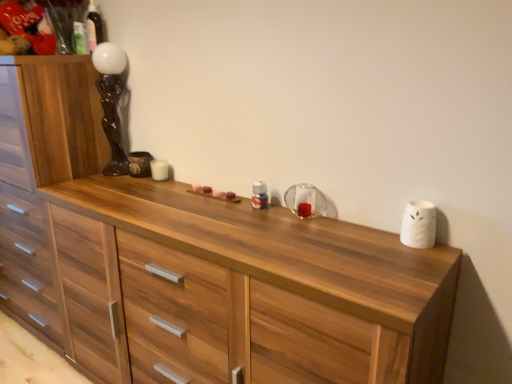
Question: Considering the relative sizes of wooden chest of drawers at left and black glossy statue at upper left in the image provided, is wooden chest of drawers at left shorter than black glossy statue at upper left?

Choices:
 (A) yes
 (B) no

Answer: (B)

Question: Considering the relative sizes of wooden chest of drawers at left and black glossy statue at upper left in the image provided, is wooden chest of drawers at left thinner than black glossy statue at upper left?

Choices:
 (A) no
 (B) yes

Answer: (A)

Question: Does wooden chest of drawers at left have a greater width compared to black glossy statue at upper left?

Choices:
 (A) yes
 (B) no

Answer: (A)

Question: From the image's perspective, is wooden chest of drawers at left above black glossy statue at upper left?

Choices:
 (A) yes
 (B) no

Answer: (B)

Question: Is wooden chest of drawers at left not within black glossy statue at upper left?

Choices:
 (A) yes
 (B) no

Answer: (A)

Question: Is wooden chest of drawers at left facing towards black glossy statue at upper left?

Choices:
 (A) no
 (B) yes

Answer: (A)

Question: Does black glossy statue at upper left appear on the left side of wooden chest of drawers at left?

Choices:
 (A) no
 (B) yes

Answer: (A)

Question: Considering the relative sizes of black glossy statue at upper left and wooden chest of drawers at left in the image provided, is black glossy statue at upper left shorter than wooden chest of drawers at left?

Choices:
 (A) yes
 (B) no

Answer: (A)

Question: Is wooden chest of drawers at left surrounded by black glossy statue at upper left?

Choices:
 (A) yes
 (B) no

Answer: (B)

Question: Is black glossy statue at upper left thinner than wooden chest of drawers at left?

Choices:
 (A) no
 (B) yes

Answer: (B)

Question: Can you confirm if black glossy statue at upper left is taller than wooden chest of drawers at left?

Choices:
 (A) yes
 (B) no

Answer: (B)

Question: Considering the relative positions of black glossy statue at upper left and wooden chest of drawers at left in the image provided, is black glossy statue at upper left behind wooden chest of drawers at left?

Choices:
 (A) yes
 (B) no

Answer: (A)

Question: Visually, is black glossy statue at upper left positioned to the left or to the right of wooden chest of drawers at left?

Choices:
 (A) left
 (B) right

Answer: (B)